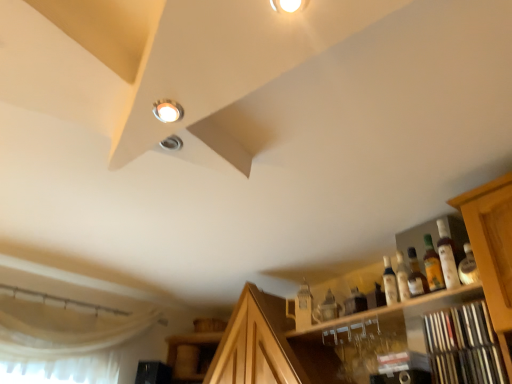
Question: Is translucent glass bottle at right, the first bottle when ordered from right to left, spatially inside wooden shelf at lower right, or outside of it?

Choices:
 (A) outside
 (B) inside

Answer: (A)

Question: Does point (444, 273) appear closer or farther from the camera than point (442, 345)?

Choices:
 (A) closer
 (B) farther

Answer: (B)

Question: Based on their relative distances, which object is farther from the matte glass bottle at right, arranged as the 3th bottle when viewed from the right?

Choices:
 (A) translucent glass bottle at right, the first bottle when ordered from right to left
 (B) wooden shelf at lower right
 (C) wooden cabinet at upper right
 (D) translucent amber bottle at upper right, marked as the 2th bottle in a left-to-right arrangement
 (E) matte white droplight at upper left

Answer: (E)

Question: Which of these objects is positioned farthest from the translucent glass bottle at right, marked as the 3th bottle in a left-to-right arrangement?

Choices:
 (A) translucent amber bottle at upper right, marked as the 2th bottle in a left-to-right arrangement
 (B) matte glass bottle at right, the 1th bottle positioned from the left
 (C) wooden shelf at lower right
 (D) matte white droplight at upper left
 (E) wooden cabinet at upper right

Answer: (D)